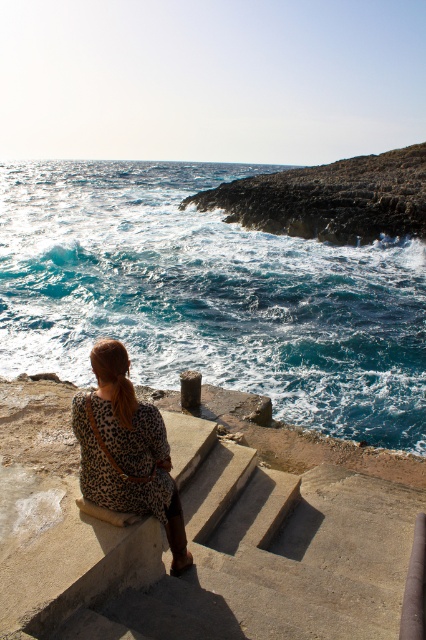
From the picture: Is blue water at center positioned behind leopard print dress at center?

Yes, it is.

Locate an element on the screen. The height and width of the screenshot is (640, 426). blue water at center is located at coordinates (210, 296).

Based on the photo, who is more forward, (316, 388) or (377, 451)?

Point (377, 451)

Who is taller, blue water at center or concrete ledge at lower left?

blue water at center

The height and width of the screenshot is (640, 426). Describe the element at coordinates (210, 296) in the screenshot. I see `blue water at center` at that location.

This screenshot has height=640, width=426. I want to click on blue water at center, so coord(210,296).

Is concrete ledge at lower left shorter than leopard print dress at center?

Indeed, concrete ledge at lower left has a lesser height compared to leopard print dress at center.

Between concrete ledge at lower left and leopard print dress at center, which one has more height?

With more height is leopard print dress at center.

Who is more distant from viewer, (175, 637) or (169, 520)?

Positioned behind is point (169, 520).

Locate an element on the screen. concrete ledge at lower left is located at coordinates (204, 531).